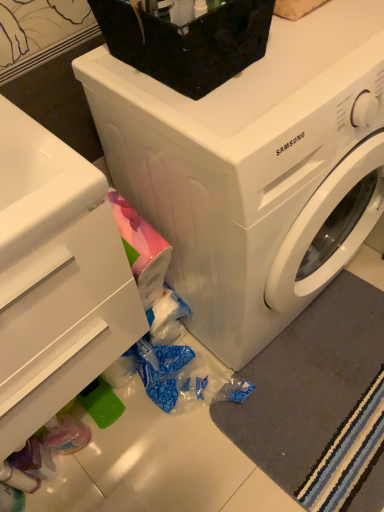
Where is `empty space that is ontop of white glossy washing machine at center`? Image resolution: width=384 pixels, height=512 pixels. empty space that is ontop of white glossy washing machine at center is located at coordinates (299, 56).